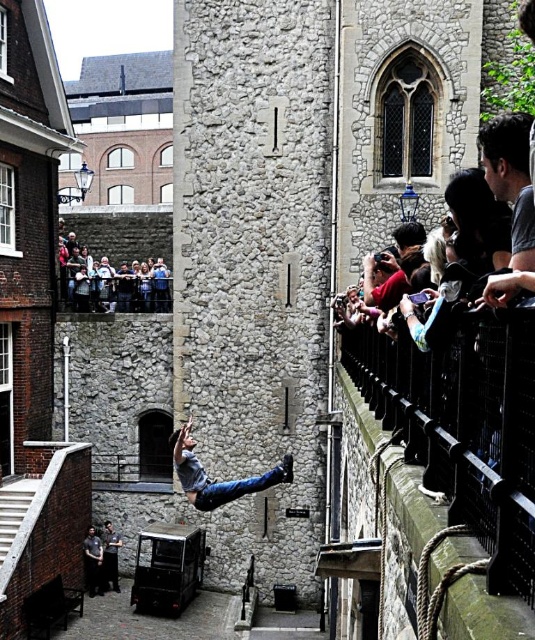
Who is more distant from viewer, (x=95, y=228) or (x=179, y=442)?

The point (x=95, y=228) is more distant.

At what (x,y) coordinates should I click in order to perform the action: click on matte gray stone crowd at upper left. Please return your answer as a coordinate pair (x, y). Image resolution: width=535 pixels, height=640 pixels. Looking at the image, I should click on (124, 234).

Where is `matte gray stone crowd at upper left`? This screenshot has width=535, height=640. matte gray stone crowd at upper left is located at coordinates (124, 234).

Does dark blue jeans at lower center lie in front of dark gray uniform at center?

Yes, dark blue jeans at lower center is in front of dark gray uniform at center.

This screenshot has height=640, width=535. What are the coordinates of `dark blue jeans at lower center` in the screenshot? It's located at [x=93, y=561].

Find the location of `dark blue jeans at lower center`. dark blue jeans at lower center is located at coordinates (x=93, y=561).

Does point (156, 253) lie in front of point (108, 570)?

No, it is not.

Consider the image. Is matte gray stone crowd at upper left thinner than dark gray uniform at center?

Incorrect, matte gray stone crowd at upper left's width is not less than dark gray uniform at center's.

Does point (133, 220) lie behind point (103, 547)?

Yes.

Identify the location of matte gray stone crowd at upper left. The width and height of the screenshot is (535, 640). (124, 234).